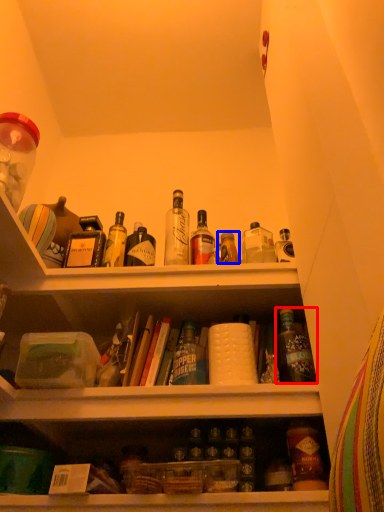
Question: Which of the following is the farthest to the observer, bottle (highlighted by a red box) or bottle (highlighted by a blue box)?

Choices:
 (A) bottle
 (B) bottle

Answer: (B)